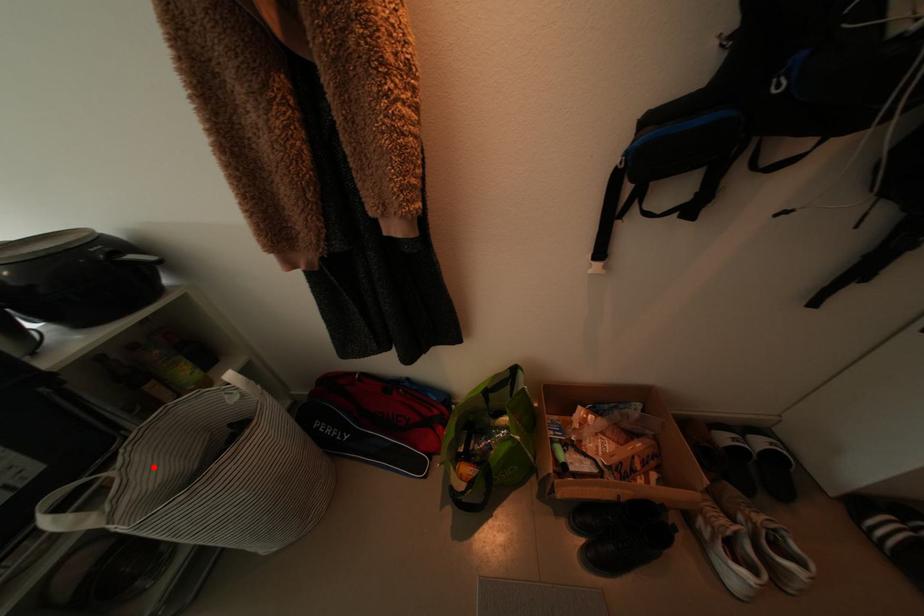
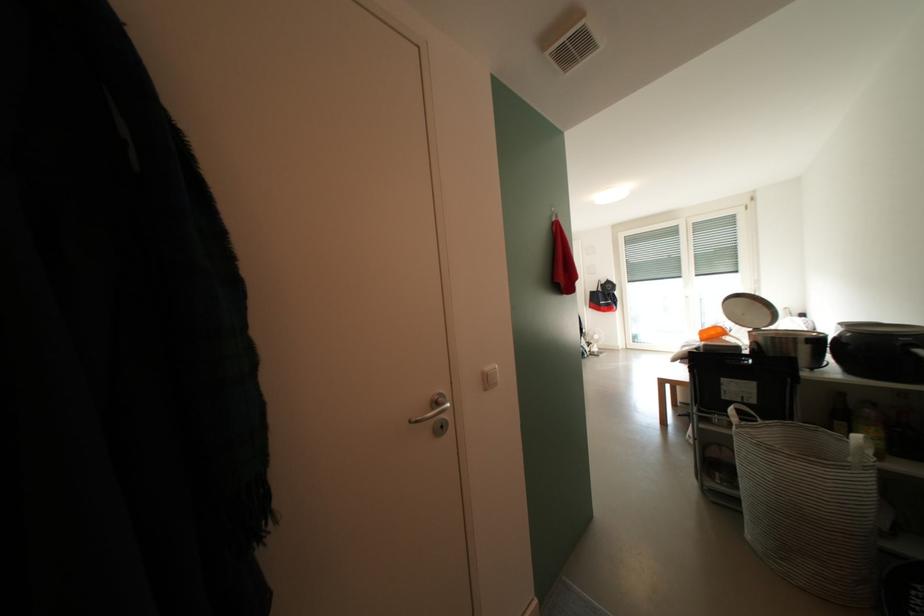
The point at the highlighted location is marked in the first image. Where is the corresponding point in the second image?

(779, 435)